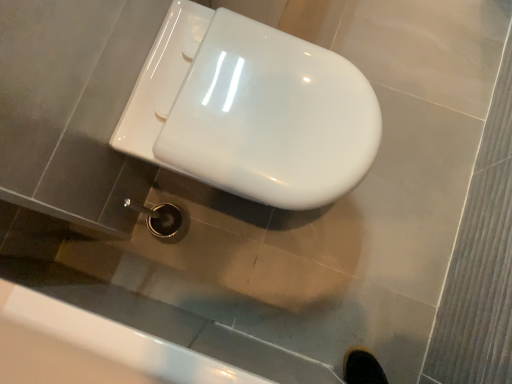
This screenshot has width=512, height=384. Identify the location of vacant area that is in front of white glossy toilet at center. (244, 276).